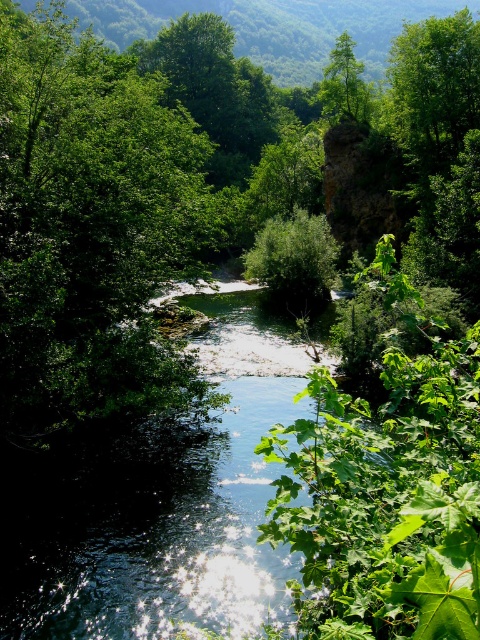
Is clear water at center behind green leafy tree at upper center?

No.

Can you confirm if clear water at center is taller than green leafy tree at upper center?

No.

Measure the distance between clear water at center and camera.

They are 9.01 meters apart.

Locate an element on the screen. clear water at center is located at coordinates (159, 504).